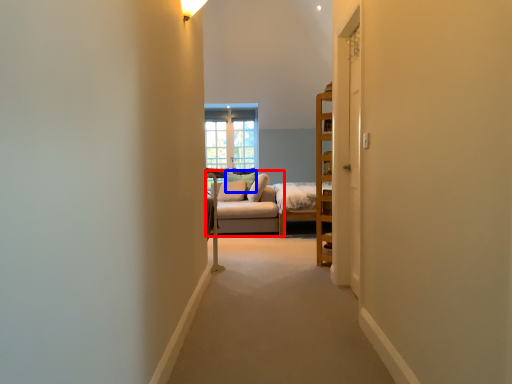
Question: Which of the following is the farthest to the observer, studio couch (highlighted by a red box) or pillow (highlighted by a blue box)?

Choices:
 (A) studio couch
 (B) pillow

Answer: (B)